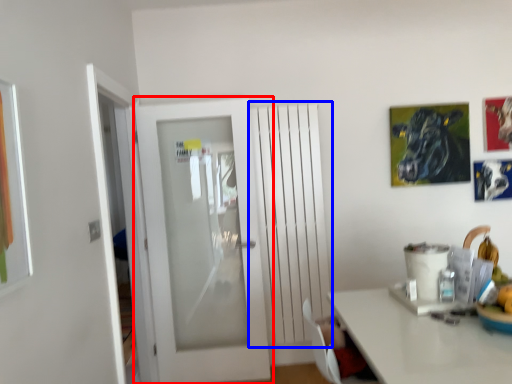
Question: Which object is closer to the camera taking this photo, door (highlighted by a red box) or radiator (highlighted by a blue box)?

Choices:
 (A) door
 (B) radiator

Answer: (A)